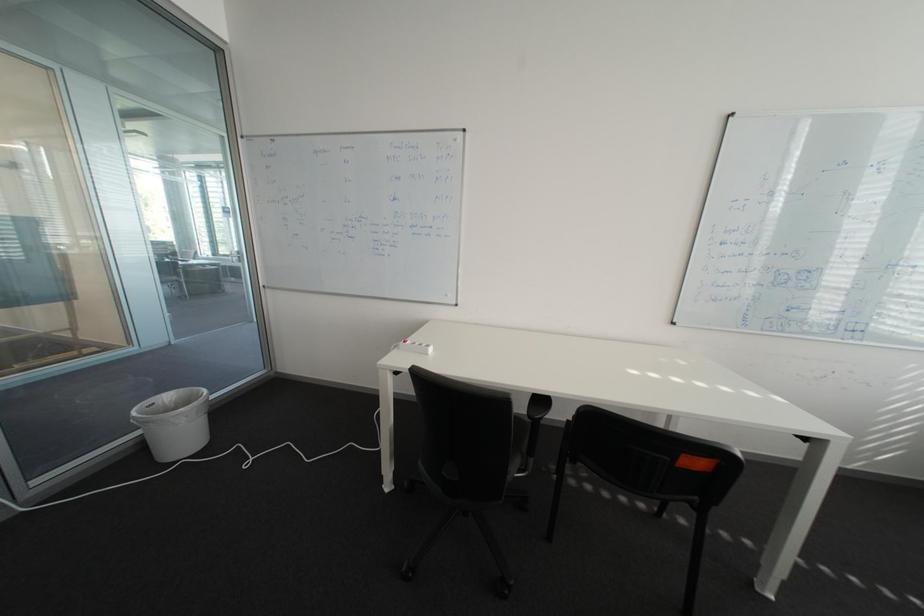
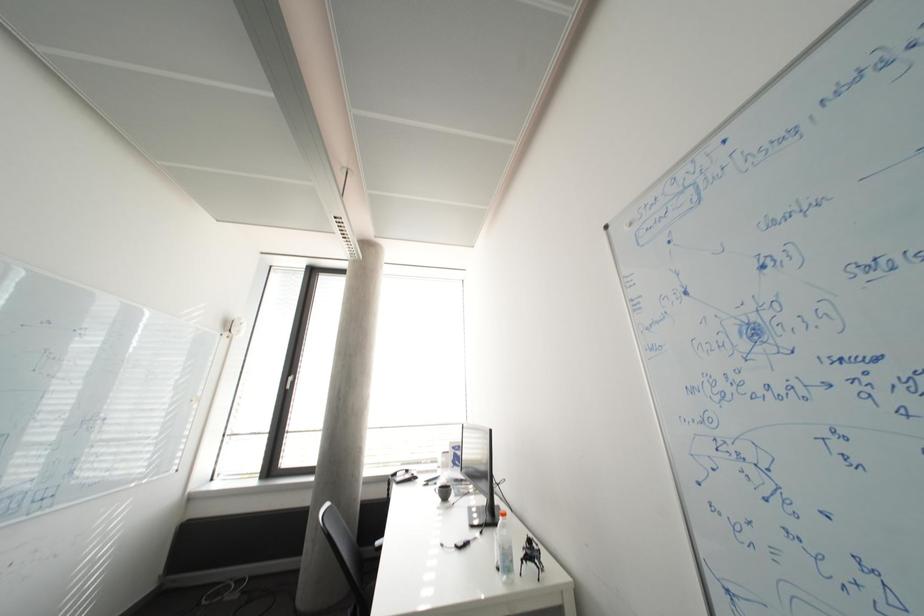
Question: The camera is either moving clockwise (left) or counter-clockwise (right) around the object. The first image is from the beginning of the video and the second image is from the end. Is the camera moving left or right when shooting the video?

Choices:
 (A) Left
 (B) Right

Answer: (A)